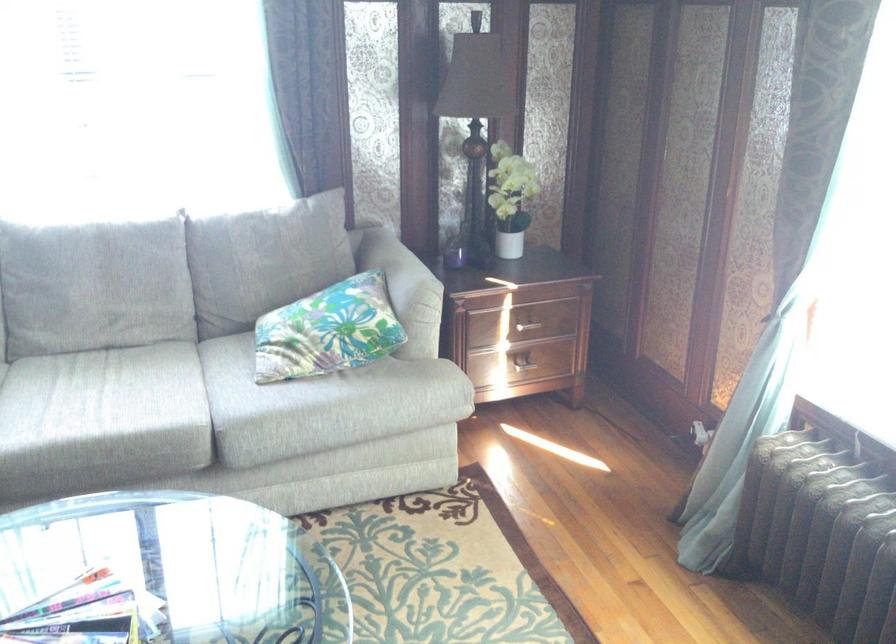
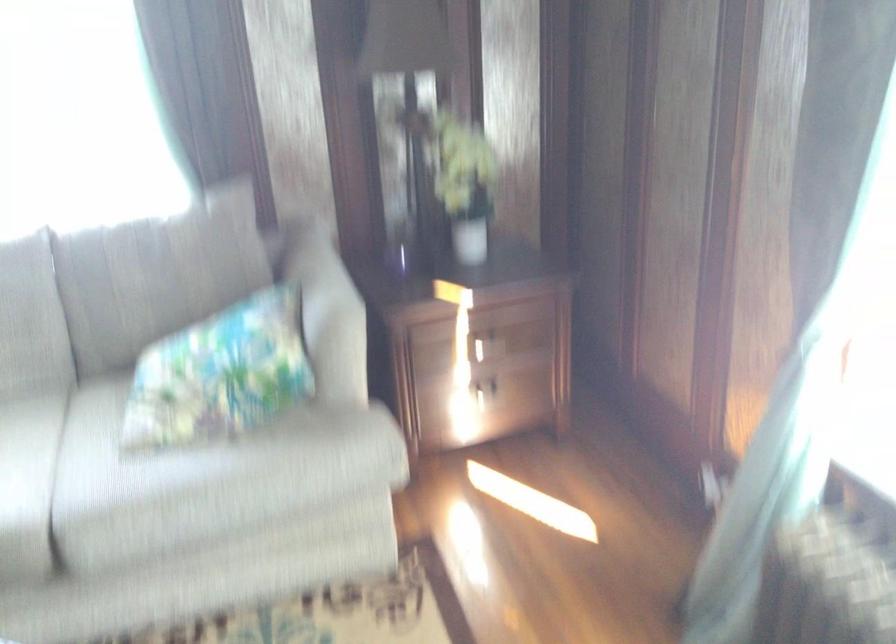
Based on the photo, the images are taken continuously from a first-person perspective. In which direction are you moving?

The movement direction of the cameraman is right, forward.